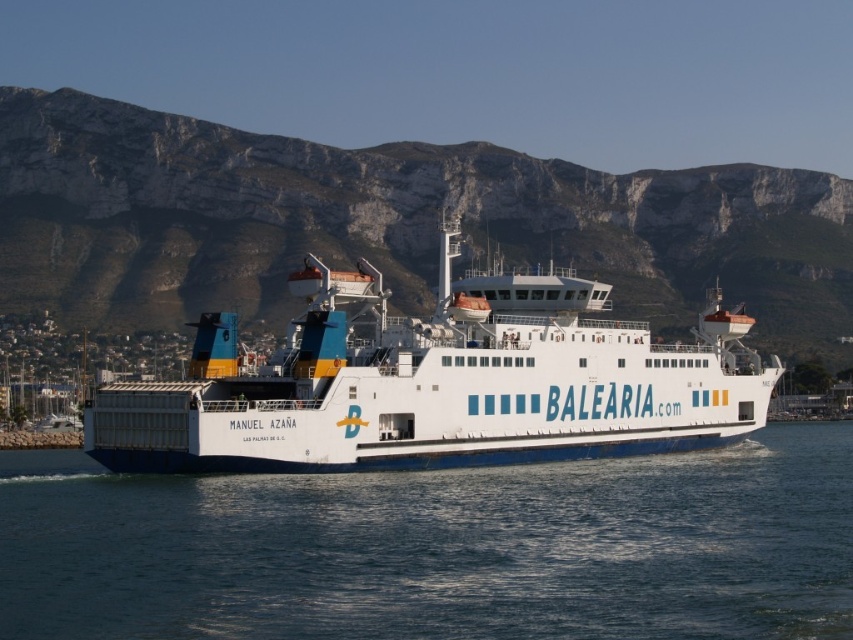
You are a photographer trying to capture the ferry against the dramatic landscape in the background. To ensure the blue water at center is centered in your photo, where should you position your camera relative to the ferry?

The blue water at center is located at point 0.858 on the x axis and 0.515 on the y axis, so you should position your camera slightly to the right and center vertically to align the blue water at center in the middle of the photo.

You are standing on the deck of the Manuel Aza?a ferry and see a point marked at coordinates (595, 525). The ferry has a safety regulation requiring all passengers to stay at least 150 feet away from the edge. Can you determine if the point is within the safe area?

The point at coordinates (595, 525) is 160.87 feet away from the viewer, which is beyond the 150 feet safety requirement. Therefore, the point is within the safe area.

You are a photographer on the Manuel Azauna ferry and want to capture the white rocky mountain at upper center in your shot. Where should you position yourself on the ferry to ensure the mountain is centered in your photo?

The white rocky mountain at upper center is located at point coordinates of (389, 221). To center it in your photo, position yourself on the Manuel Azauna ferry such that the mountain aligns with the center of your camera viewfinder at those coordinates.